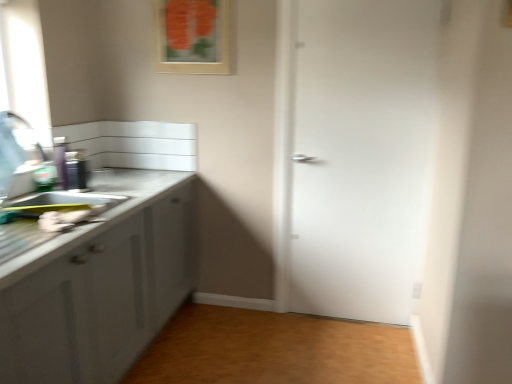
What are the coordinates of `free space to the back side of matte white sink at left` in the screenshot? It's located at 69,203.